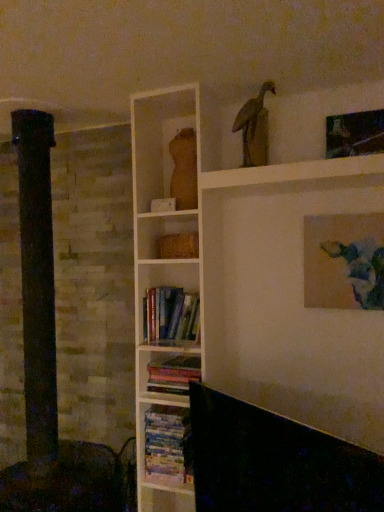
Question: Is hardcover books at center, which ranks as the 3th book in top-to-bottom order, further to camera compared to matte wooden torso at upper center?

Choices:
 (A) yes
 (B) no

Answer: (B)

Question: Is hardcover books at center, which ranks as the 3th book in top-to-bottom order, to the left of matte wooden torso at upper center from the viewer's perspective?

Choices:
 (A) no
 (B) yes

Answer: (B)

Question: From a real-world perspective, is hardcover books at center, the 1th book ordered from the bottom, below matte wooden torso at upper center?

Choices:
 (A) yes
 (B) no

Answer: (A)

Question: Is matte wooden torso at upper center a part of hardcover books at center, the 1th book ordered from the bottom?

Choices:
 (A) no
 (B) yes

Answer: (A)

Question: Is hardcover books at center, which ranks as the 3th book in top-to-bottom order, positioned before matte wooden torso at upper center?

Choices:
 (A) yes
 (B) no

Answer: (A)

Question: Does point (180, 161) appear closer or farther from the camera than point (162, 291)?

Choices:
 (A) farther
 (B) closer

Answer: (B)

Question: In terms of size, does matte wooden torso at upper center appear bigger or smaller than hardcover books at center, marked as the first book in a top-to-bottom arrangement?

Choices:
 (A) big
 (B) small

Answer: (B)

Question: Based on their positions, is matte wooden torso at upper center located to the left or right of hardcover books at center, marked as the third book in a bottom-to-top arrangement?

Choices:
 (A) left
 (B) right

Answer: (B)

Question: In the image, is matte wooden torso at upper center positioned in front of or behind hardcover books at center, marked as the first book in a top-to-bottom arrangement?

Choices:
 (A) behind
 (B) front

Answer: (A)

Question: Is hardcover books at center, the 1th book ordered from the bottom, taller or shorter than hardcover books at center, positioned as the second book in bottom-to-top order?

Choices:
 (A) tall
 (B) short

Answer: (A)

Question: From a real-world perspective, is hardcover books at center, which ranks as the 3th book in top-to-bottom order, positioned above or below hardcover books at center, positioned as the second book in bottom-to-top order?

Choices:
 (A) below
 (B) above

Answer: (A)

Question: Is hardcover books at center, which ranks as the 3th book in top-to-bottom order, spatially inside hardcover books at center, the second book when ordered from top to bottom, or outside of it?

Choices:
 (A) outside
 (B) inside

Answer: (A)

Question: From the image's perspective, is hardcover books at center, the 1th book ordered from the bottom, positioned above or below hardcover books at center, positioned as the second book in bottom-to-top order?

Choices:
 (A) above
 (B) below

Answer: (B)

Question: Is metallic silver picture frame at upper right, which ranks as the first picture frame in top-to-bottom order, situated inside hardcover books at center, marked as the third book in a bottom-to-top arrangement, or outside?

Choices:
 (A) inside
 (B) outside

Answer: (B)

Question: Considering the positions of point (367, 113) and point (182, 321), is point (367, 113) closer or farther from the camera than point (182, 321)?

Choices:
 (A) farther
 (B) closer

Answer: (B)